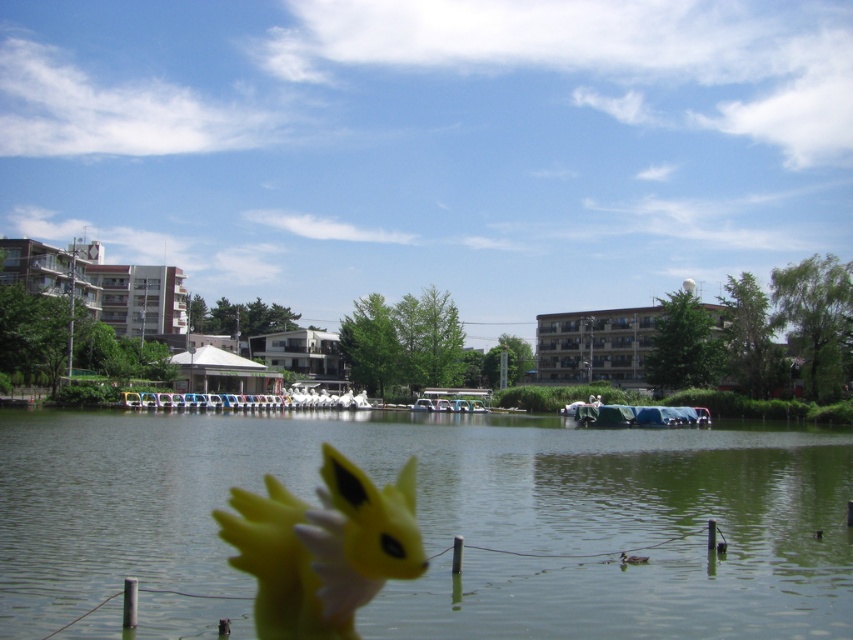
You are planning to take a photo of the green smooth water at center and the yellow matte toy at center. Which object should you focus on if you want the other to appear slightly out of focus?

You should focus on the green smooth water at center because it is bigger than the yellow matte toy at center, so focusing on the larger object will naturally cause the smaller one to appear out of focus.

You are planning to place a small floating decoration on the lake. The decoration requires a space that is wider than the yellow matte toy at center. Can the green smooth water at center provide enough width for this?

The green smooth water at center is wider than the yellow matte toy at center, so it can accommodate the decoration requiring more width than the toy.

You are standing at the lakeside and want to locate two specific points marked in the image. The first point is at coordinates point (x=85, y=490) and the second is at point (x=421, y=540). From your current position, which point is closer to you?

Point (x=421, y=540) is closer to you because it is in front of point (x=85, y=490) according to their spatial arrangement.